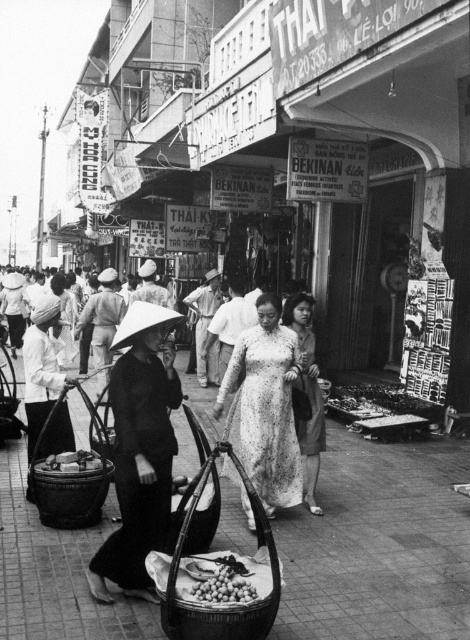
In the scene shown: You are standing at the entrance of the street and see the white floral dress at center. Based on its position, can you determine if it is closer to the left or right side of the street?

The white floral dress at center is located at point 0.636 on the x axis, which is closer to the right side of the street.

You are a customer in this historical street scene. You see the white floral dress at center and the smooth brown nuts at center. Which item is higher in height?

The white floral dress at center is taller than the smooth brown nuts at center.